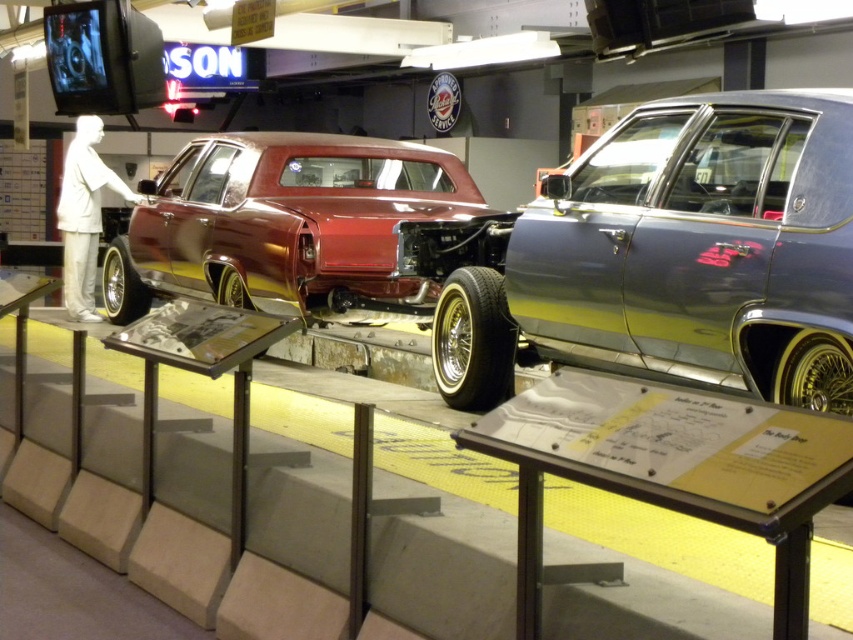
Where is the shiny maroon body at center located in the image?

The shiny maroon body at center is located at point coordinates of (285, 225).

You are a museum visitor who wants to take a photo of both the metallic silver car at right and the shiny maroon body at center. Since you want to include both cars in a single frame, which car should you position closer to the camera to ensure both fit in the photo?

To include both cars in a single frame, position the metallic silver car at right closer to the camera because it is shorter than the shiny maroon body at center, allowing both to fit within the photo.